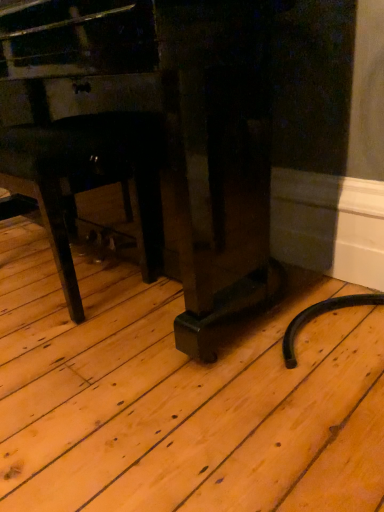
Question: Is black matte chair at lower left, acting as the 2th furniture starting from the right, positioned in front of matte black piano at center, which ranks as the 2th furniture in left-to-right order?

Choices:
 (A) no
 (B) yes

Answer: (A)

Question: From a real-world perspective, does black matte chair at lower left, acting as the 2th furniture starting from the right, stand above matte black piano at center, which ranks as the 2th furniture in left-to-right order?

Choices:
 (A) yes
 (B) no

Answer: (B)

Question: Considering the relative sizes of black matte chair at lower left, acting as the 2th furniture starting from the right, and matte black piano at center, arranged as the 1th furniture when viewed from the right, in the image provided, is black matte chair at lower left, acting as the 2th furniture starting from the right, taller than matte black piano at center, arranged as the 1th furniture when viewed from the right,?

Choices:
 (A) yes
 (B) no

Answer: (B)

Question: Considering the relative sizes of black matte chair at lower left, the first furniture viewed from the left, and matte black piano at center, arranged as the 1th furniture when viewed from the right, in the image provided, is black matte chair at lower left, the first furniture viewed from the left, shorter than matte black piano at center, arranged as the 1th furniture when viewed from the right,?

Choices:
 (A) no
 (B) yes

Answer: (B)

Question: Is black matte chair at lower left, acting as the 2th furniture starting from the right, at the right side of matte black piano at center, arranged as the 1th furniture when viewed from the right?

Choices:
 (A) no
 (B) yes

Answer: (A)

Question: Is black matte chair at lower left, the first furniture viewed from the left, located outside matte black piano at center, which ranks as the 2th furniture in left-to-right order?

Choices:
 (A) yes
 (B) no

Answer: (B)

Question: Can you confirm if matte black piano at center, arranged as the 1th furniture when viewed from the right, is positioned to the right of black matte chair at lower left, the first furniture viewed from the left?

Choices:
 (A) no
 (B) yes

Answer: (B)

Question: Considering the relative sizes of matte black piano at center, arranged as the 1th furniture when viewed from the right, and black matte chair at lower left, the first furniture viewed from the left, in the image provided, is matte black piano at center, arranged as the 1th furniture when viewed from the right, shorter than black matte chair at lower left, the first furniture viewed from the left,?

Choices:
 (A) no
 (B) yes

Answer: (A)

Question: Considering the relative sizes of matte black piano at center, which ranks as the 2th furniture in left-to-right order, and black matte chair at lower left, acting as the 2th furniture starting from the right, in the image provided, is matte black piano at center, which ranks as the 2th furniture in left-to-right order, smaller than black matte chair at lower left, acting as the 2th furniture starting from the right,?

Choices:
 (A) no
 (B) yes

Answer: (A)

Question: Is the position of matte black piano at center, which ranks as the 2th furniture in left-to-right order, less distant than that of black matte chair at lower left, the first furniture viewed from the left?

Choices:
 (A) no
 (B) yes

Answer: (B)

Question: Can you confirm if matte black piano at center, arranged as the 1th furniture when viewed from the right, is thinner than black matte chair at lower left, the first furniture viewed from the left?

Choices:
 (A) no
 (B) yes

Answer: (A)

Question: From a real-world perspective, is matte black piano at center, which ranks as the 2th furniture in left-to-right order, physically above black matte chair at lower left, the first furniture viewed from the left?

Choices:
 (A) yes
 (B) no

Answer: (A)

Question: From their relative heights in the image, would you say matte black piano at center, which ranks as the 2th furniture in left-to-right order, is taller or shorter than black matte chair at lower left, the first furniture viewed from the left?

Choices:
 (A) short
 (B) tall

Answer: (B)